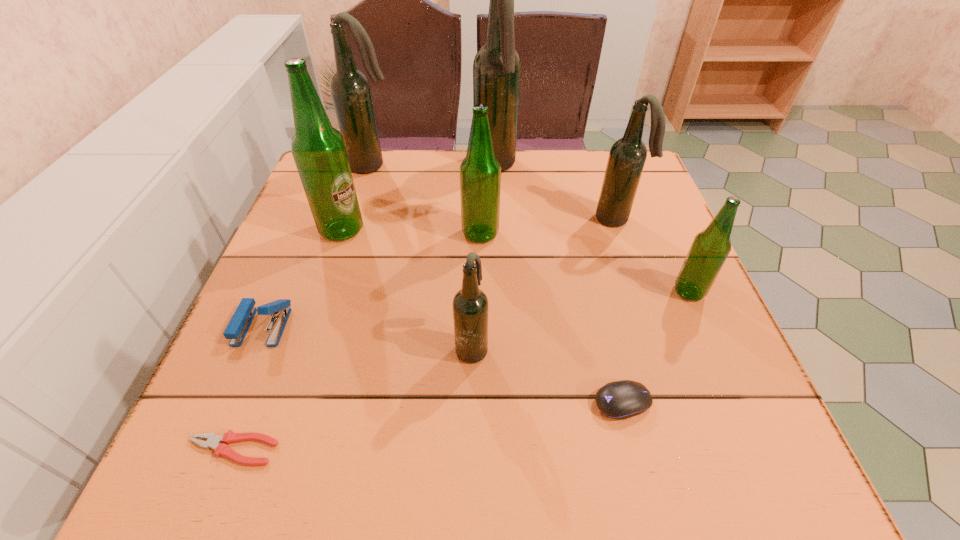
This screenshot has width=960, height=540. I want to click on the tallest object, so click(497, 66).

This screenshot has width=960, height=540. I want to click on the tallest beer bottle, so click(x=497, y=66).

Where is `the leftmost dark beer bottle`? This screenshot has height=540, width=960. the leftmost dark beer bottle is located at coordinates (350, 90).

Find the location of a particular element. The image size is (960, 540). the biggest green beer bottle is located at coordinates (318, 149).

Identify the location of the rightmost dark beer bottle. (627, 157).

Locate an element on the screen. the second nearest dark beer bottle is located at coordinates [627, 157].

Locate an element on the screen. The width and height of the screenshot is (960, 540). the second smallest green beer bottle is located at coordinates (480, 172).

This screenshot has width=960, height=540. Identify the location of the second nearest beer bottle. (710, 248).

Locate an element on the screen. Image resolution: width=960 pixels, height=540 pixels. the rightmost green beer bottle is located at coordinates (710, 248).

Identify the location of the nearest beer bottle. The width and height of the screenshot is (960, 540). (470, 304).